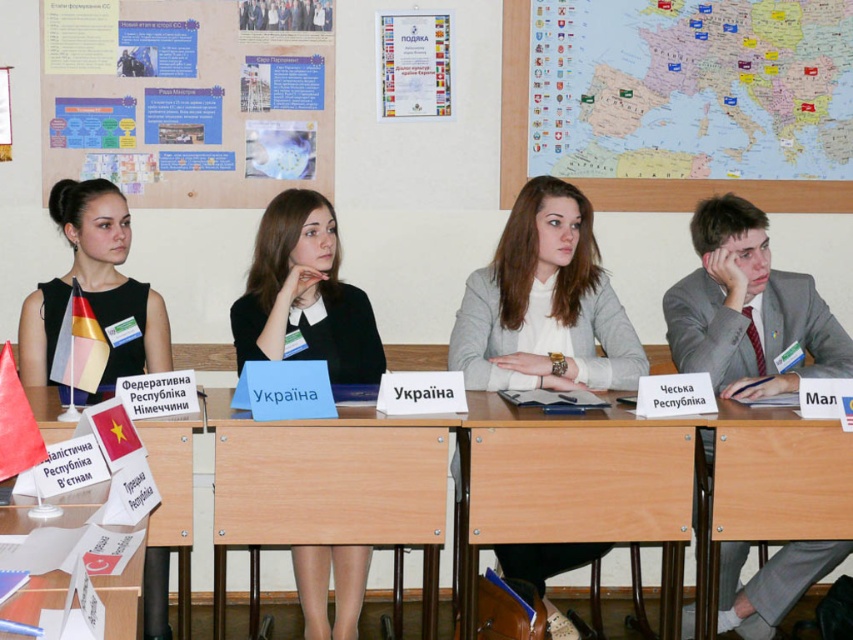
Does beech wood table at center appear on the right side of wooden table at center?

Correct, you'll find beech wood table at center to the right of wooden table at center.

Which is behind, point (537, 483) or point (347, 508)?

The point (537, 483) is behind.

Between point (579, 440) and point (329, 461), which one is positioned in front?

Point (329, 461) is in front.

Find the location of `beech wood table at center`. beech wood table at center is located at coordinates (573, 486).

Can you confirm if paper map at upper center is taller than black matte dress at center?

Indeed, paper map at upper center has a greater height compared to black matte dress at center.

Which is above, paper map at upper center or black matte dress at center?

paper map at upper center

Is point (592, 20) positioned after point (329, 317)?

Yes, it is.

The height and width of the screenshot is (640, 853). In order to click on paper map at upper center in this screenshot , I will do `click(691, 88)`.

Which is in front, point (276, 17) or point (602, 456)?

Positioned in front is point (602, 456).

Is matte paper poster at upper left taller than beech wood table at center?

Indeed, matte paper poster at upper left has a greater height compared to beech wood table at center.

Between point (320, 138) and point (631, 493), which one is positioned behind?

Positioned behind is point (320, 138).

What are the coordinates of `matte paper poster at upper left` in the screenshot? It's located at (189, 97).